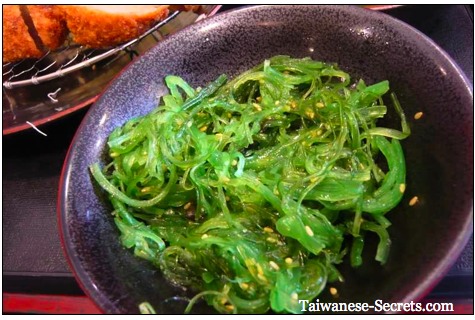
Find the location of `plate`. plate is located at coordinates (78, 91).